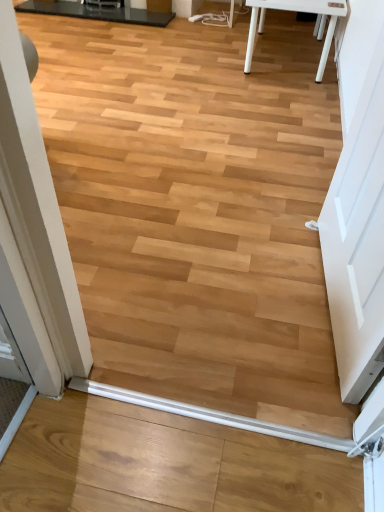
Question: Looking at the image, does white matte door at right seem bigger or smaller compared to white plastic beam at lower center?

Choices:
 (A) big
 (B) small

Answer: (A)

Question: From the image's perspective, relative to white plastic beam at lower center, is white matte door at right above or below?

Choices:
 (A) below
 (B) above

Answer: (B)

Question: Based on their relative distances, which object is nearer to the white matte door at right?

Choices:
 (A) black glossy table at upper left
 (B) white plastic beam at lower center

Answer: (B)

Question: Based on their relative distances, which object is nearer to the white plastic beam at lower center?

Choices:
 (A) black glossy table at upper left
 (B) white matte door at right

Answer: (B)